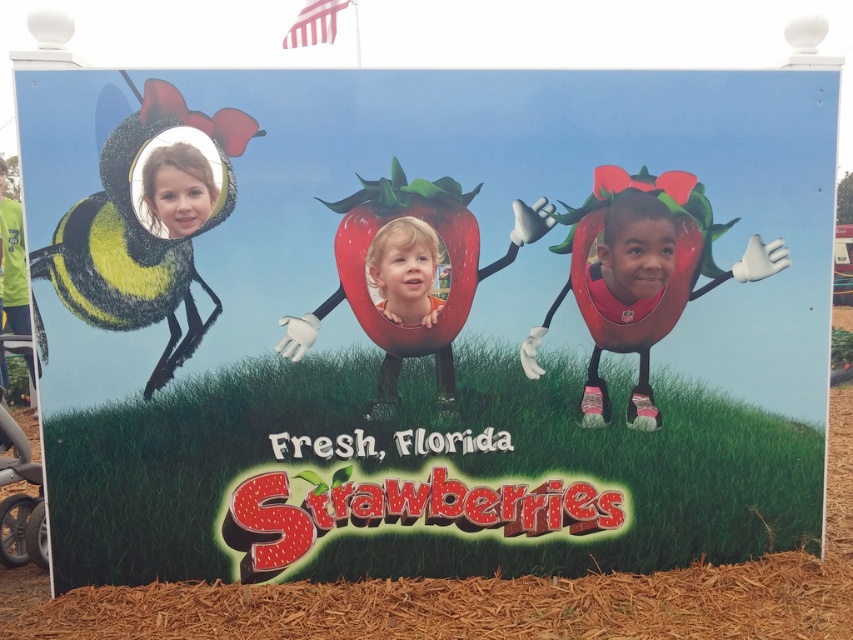
Which of these two, smooth orange shirt at center or smooth skin face at upper left, stands taller?

smooth orange shirt at center is taller.

Which is in front, point (383, 257) or point (166, 214)?

Positioned in front is point (166, 214).

The width and height of the screenshot is (853, 640). I want to click on smooth orange shirt at center, so click(405, 269).

The image size is (853, 640). Find the location of `smooth orange shirt at center`. smooth orange shirt at center is located at coordinates (405, 269).